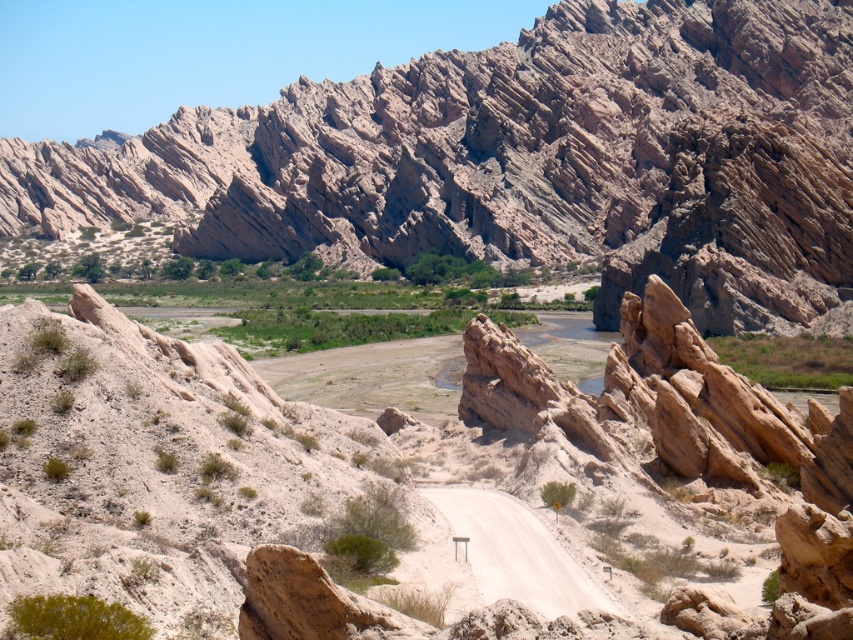
Between rustic rock formation at upper center and white sandy dirt road at center, which one has less height?

Standing shorter between the two is white sandy dirt road at center.

Between rustic rock formation at upper center and white sandy dirt road at center, which one appears on the left side from the viewer's perspective?

rustic rock formation at upper center is more to the left.

Does point (454, 100) come farther from viewer compared to point (482, 563)?

Yes, it is behind point (482, 563).

Where is `rustic rock formation at upper center`? This screenshot has width=853, height=640. rustic rock formation at upper center is located at coordinates (526, 161).